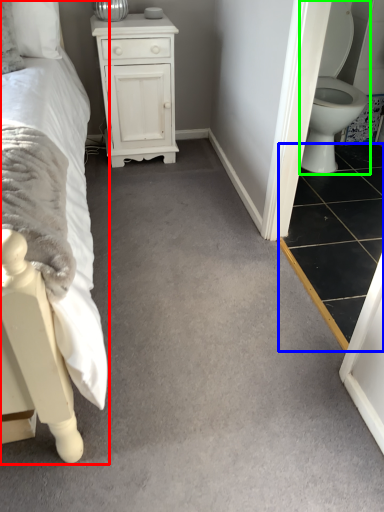
Question: Estimate the real-world distances between objects in this image. Which object is farther from bed (highlighted by a red box), tile (highlighted by a blue box) or toilet (highlighted by a green box)?

Choices:
 (A) tile
 (B) toilet

Answer: (B)